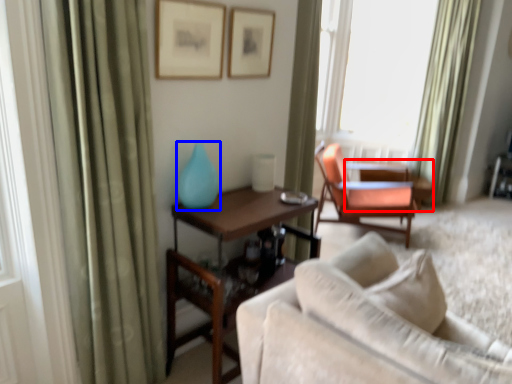
Question: Which point is closer to the camera, table (highlighted by a red box) or turquoise (highlighted by a blue box)?

Choices:
 (A) table
 (B) turquoise

Answer: (B)